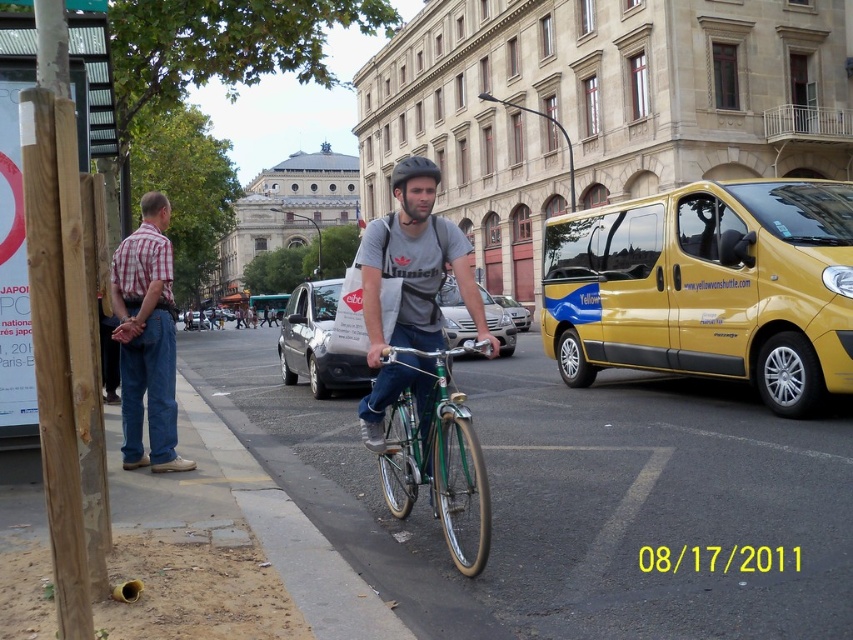
You are a photographer trying to capture a clear shot of the matte gray shirt at center and the matte black helmet at center. Since the camera has a limited focus range, you need to know which object is closer to the camera. Can you determine which one is closer based on their sizes?

The matte gray shirt at center is smaller than the matte black helmet at center, so the matte black helmet at center is closer to the camera because objects closer to the camera appear larger.

You are a pedestrian standing on the sidewalk and see the yellow metallic van at right and the green metallic bicycle at center. Which object is positioned higher in the image?

The yellow metallic van at right is positioned higher than the green metallic bicycle at center in the image.